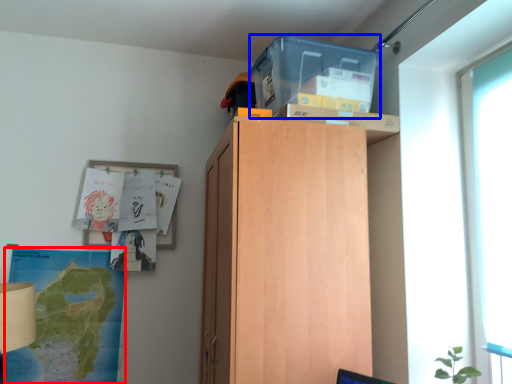
Question: Among these objects, which one is farthest to the camera, map (highlighted by a red box) or storage box (highlighted by a blue box)?

Choices:
 (A) map
 (B) storage box

Answer: (A)